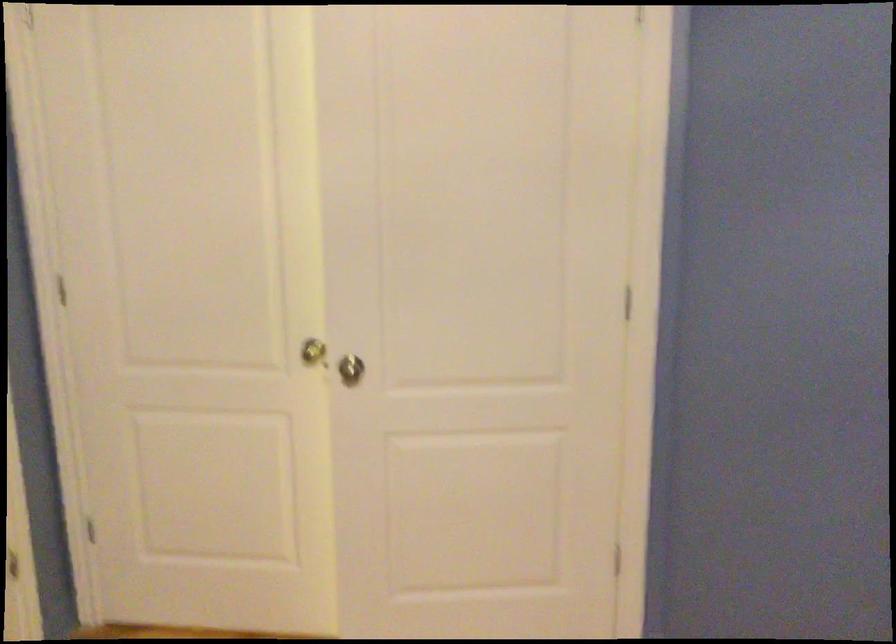
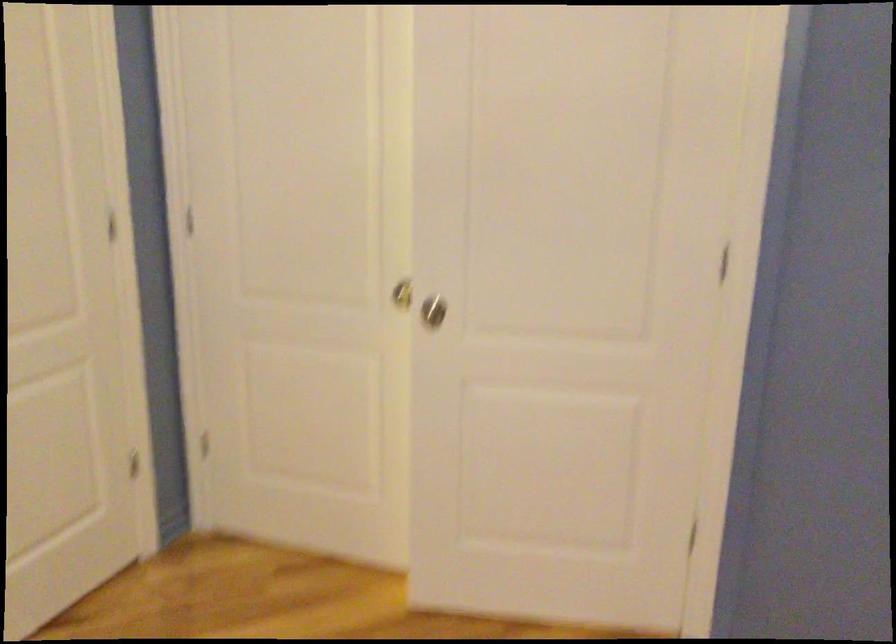
Locate, in the second image, the point that corresponds to pixel 352 365 in the first image.

(433, 310)